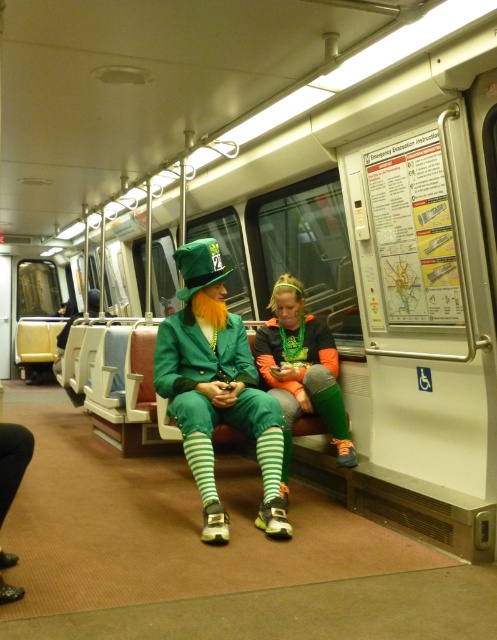
Question: Does shiny green suit at center have a smaller size compared to neon orange fabric leggings at center?

Choices:
 (A) no
 (B) yes

Answer: (A)

Question: Where is shiny green suit at center located in relation to neon orange fabric leggings at center in the image?

Choices:
 (A) left
 (B) right

Answer: (A)

Question: Is shiny green suit at center above neon orange fabric leggings at center?

Choices:
 (A) yes
 (B) no

Answer: (B)

Question: Which point appears farthest from the camera in this image?

Choices:
 (A) (283, 520)
 (B) (304, 342)

Answer: (B)

Question: Which point is closer to the camera taking this photo?

Choices:
 (A) (221, 540)
 (B) (306, 364)

Answer: (A)